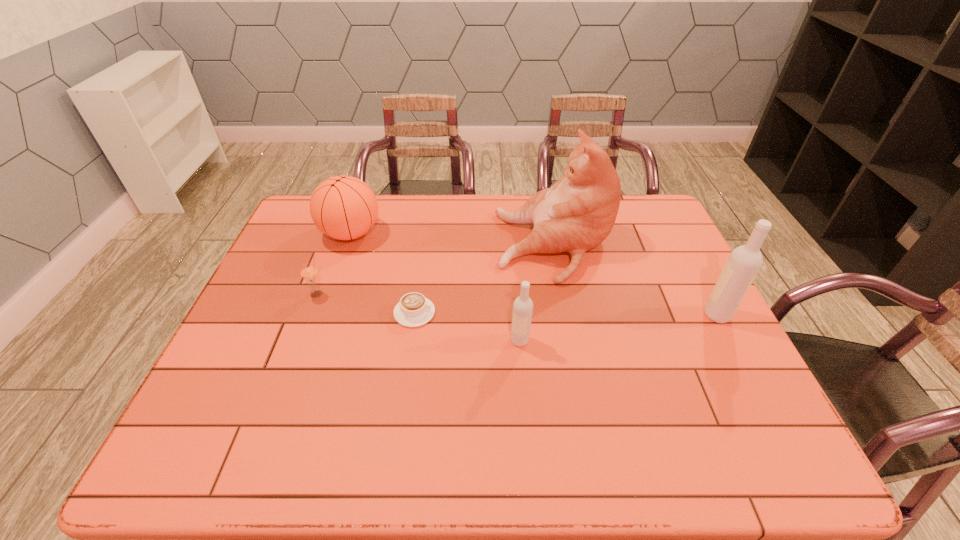
This screenshot has width=960, height=540. Identify the location of blank area located 0.330m on the back of the taller vodka. (673, 232).

The image size is (960, 540). Identify the location of free space located on the left of the basketball. (295, 233).

The width and height of the screenshot is (960, 540). I want to click on vacant point located on the face of the cat, so click(385, 246).

You are a GUI agent. You are given a task and a screenshot of the screen. Output one action in this format:
    pyautogui.click(x=<x>, y=<y>)
    Task: Click on the free space located 0.390m on the face of the cat
    
    Given the screenshot: What is the action you would take?
    pyautogui.click(x=372, y=246)

What are the coordinates of `vacant region located 0.070m on the face of the cat` in the screenshot? It's located at (474, 246).

You are a GUI agent. You are given a task and a screenshot of the screen. Output one action in this format:
    pyautogui.click(x=<x>, y=<y>)
    Task: Click on the free point located with the handle on the right side of the third object from left to right
    
    Given the screenshot: What is the action you would take?
    pyautogui.click(x=565, y=313)

Where is `free space located 0.340m on the back of the straw`? This screenshot has height=540, width=960. free space located 0.340m on the back of the straw is located at coordinates (346, 219).

Locate an element on the screen. basketball at the far edge is located at coordinates (343, 207).

In order to click on cat present at the far edge in this screenshot , I will do `click(577, 213)`.

Identify the location of basketball located at the left edge. This screenshot has height=540, width=960. (343, 207).